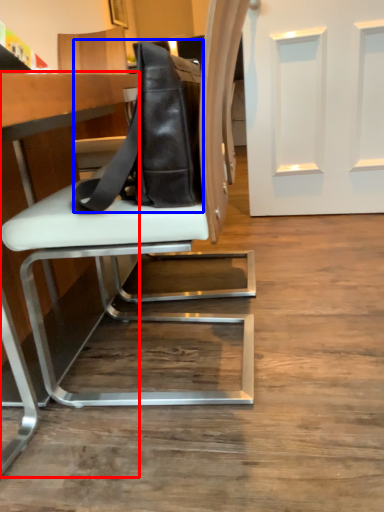
Question: Which object is closer to the camera taking this photo, table (highlighted by a red box) or messenger bag (highlighted by a blue box)?

Choices:
 (A) table
 (B) messenger bag

Answer: (A)